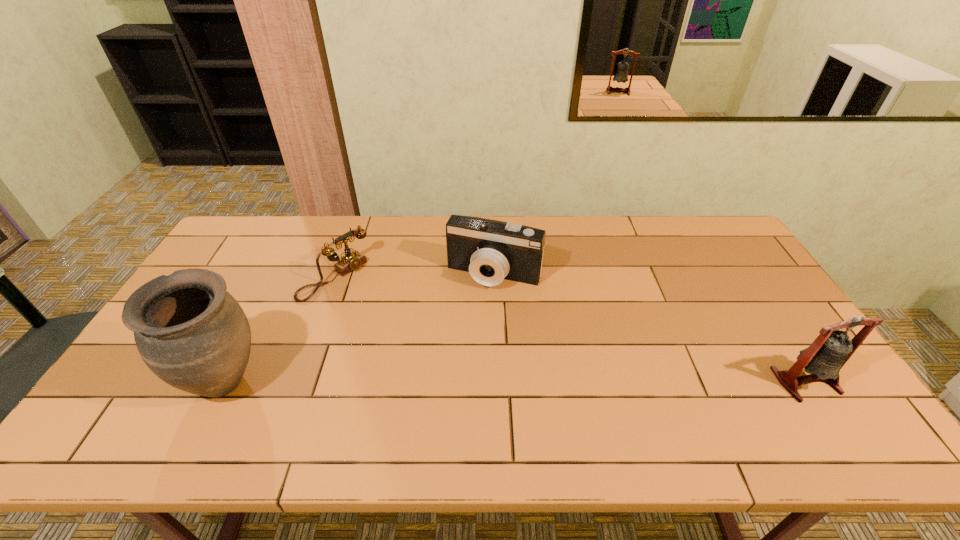
What are the coordinates of `free point between the second object from right to left and the shortest object` in the screenshot? It's located at (415, 276).

The image size is (960, 540). In order to click on free space between the shortest object and the rightmost object in this screenshot , I will do `click(570, 329)`.

Locate an element on the screen. The height and width of the screenshot is (540, 960). free space between the rightmost object and the urn is located at coordinates (516, 381).

The height and width of the screenshot is (540, 960). What are the coordinates of `blank region between the telephone and the camcorder` in the screenshot? It's located at (415, 276).

Find the location of `free space between the shortest object and the tallest object`. free space between the shortest object and the tallest object is located at coordinates (280, 329).

Point out which object is positioned as the nearest to the tallest object. Please provide its 2D coordinates. Your answer should be formatted as a tuple, i.e. [(x, y)], where the tuple contains the x and y coordinates of a point satisfying the conditions above.

[(350, 261)]

Locate an element on the screen. object that stands as the second closest to the camcorder is located at coordinates (191, 333).

This screenshot has width=960, height=540. Identify the location of free location that satisfies the following two spatial constraints: 1. on the back side of the telephone; 2. on the right side of the tallest object. (278, 277).

Identify the location of vacant space that satisfies the following two spatial constraints: 1. on the front side of the rightmost object; 2. on the left side of the camcorder. (498, 381).

The image size is (960, 540). In order to click on free space that satisfies the following two spatial constraints: 1. on the back side of the telephone; 2. on the left side of the third tallest object in this screenshot , I will do `click(335, 275)`.